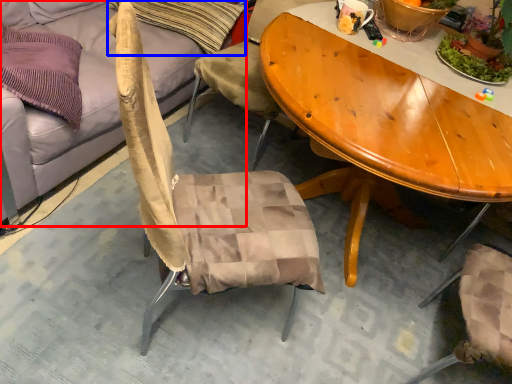
Question: Which object is closer to the camera taking this photo, studio couch (highlighted by a red box) or pillow (highlighted by a blue box)?

Choices:
 (A) studio couch
 (B) pillow

Answer: (A)